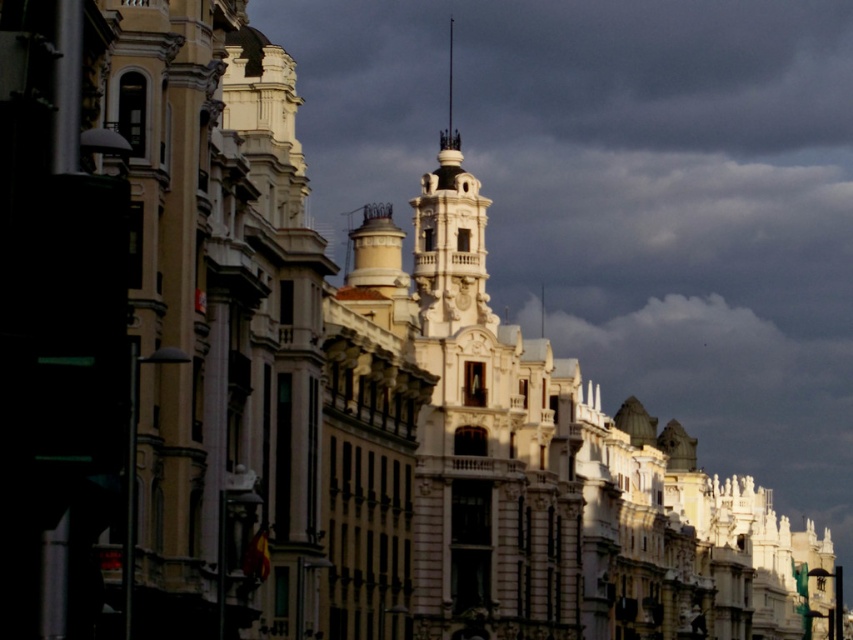
Question: Does metallic streetlight at left appear over black metal spire at upper center?

Choices:
 (A) yes
 (B) no

Answer: (B)

Question: Is metallic streetlight at left bigger than black metal spire at upper center?

Choices:
 (A) no
 (B) yes

Answer: (A)

Question: Which point appears closest to the camera in this image?

Choices:
 (A) (0, 604)
 (B) (450, 113)

Answer: (A)

Question: Which of the following is the closest to the observer?

Choices:
 (A) (91, 296)
 (B) (450, 72)

Answer: (A)

Question: Can you confirm if metallic streetlight at left is positioned below black metal spire at upper center?

Choices:
 (A) no
 (B) yes

Answer: (B)